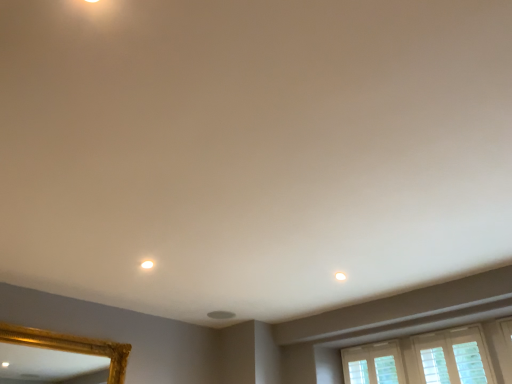
Question: Should I look upward or downward to see white matte light at upper center?

Choices:
 (A) up
 (B) down

Answer: (B)

Question: From a real-world perspective, is white matte light at upper center below white glossy light fixture at upper center?

Choices:
 (A) yes
 (B) no

Answer: (B)

Question: Would you say white matte light at upper center is a long distance from white glossy light fixture at upper center?

Choices:
 (A) yes
 (B) no

Answer: (A)

Question: Are white matte light at upper center and white glossy light fixture at upper center beside each other?

Choices:
 (A) no
 (B) yes

Answer: (A)

Question: Does white matte light at upper center have a larger size compared to white glossy light fixture at upper center?

Choices:
 (A) no
 (B) yes

Answer: (A)

Question: From the image's perspective, would you say white matte light at upper center is shown under white glossy light fixture at upper center?

Choices:
 (A) yes
 (B) no

Answer: (A)

Question: From the image's perspective, is white matte light at upper center above white glossy light fixture at upper center?

Choices:
 (A) no
 (B) yes

Answer: (A)

Question: Is white glossy light fixture at upper center positioned behind white matte light at upper center?

Choices:
 (A) yes
 (B) no

Answer: (B)

Question: Does white glossy light fixture at upper center have a larger size compared to white matte light at upper center?

Choices:
 (A) yes
 (B) no

Answer: (A)

Question: Is white matte light at upper center a part of white glossy light fixture at upper center?

Choices:
 (A) yes
 (B) no

Answer: (B)

Question: Is white glossy light fixture at upper center at the left side of white matte light at upper center?

Choices:
 (A) yes
 (B) no

Answer: (A)

Question: Is white glossy light fixture at upper center next to white matte light at upper center and touching it?

Choices:
 (A) yes
 (B) no

Answer: (B)

Question: Could you tell me if white glossy light fixture at upper center is facing white matte light at upper center?

Choices:
 (A) no
 (B) yes

Answer: (A)

Question: Considering the positions of white matte light at upper center and white glossy light fixture at upper center in the image, is white matte light at upper center taller or shorter than white glossy light fixture at upper center?

Choices:
 (A) short
 (B) tall

Answer: (A)